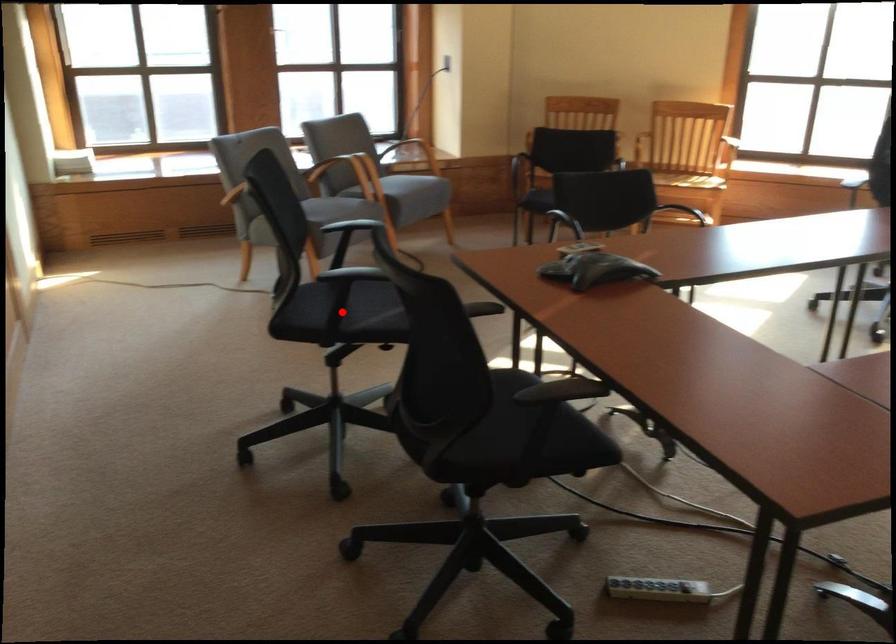
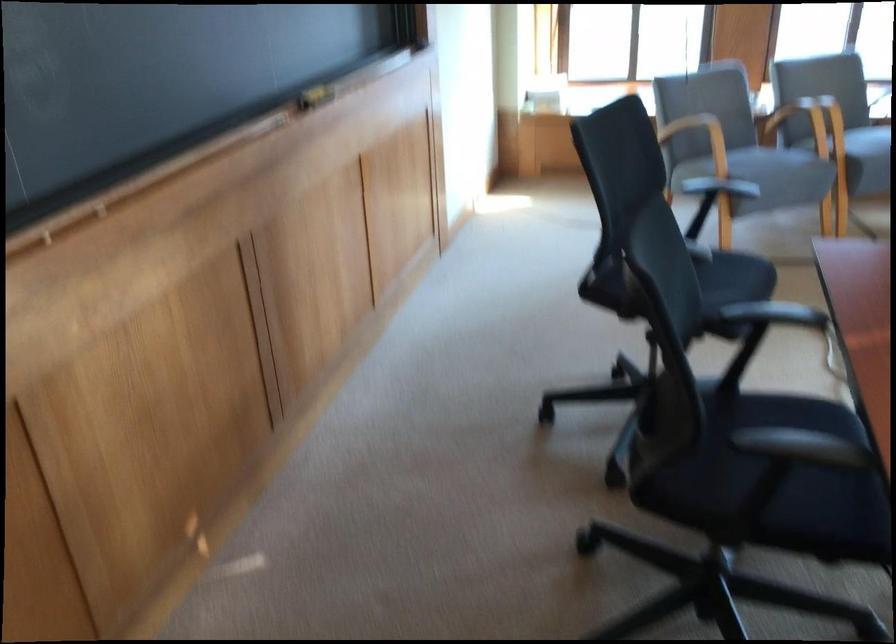
Question: I am providing you with two images of the same scene from different viewpoints. A red point is marked on the first image. Is the red point's position out of view in image 2?

Choices:
 (A) Yes
 (B) No

Answer: (A)